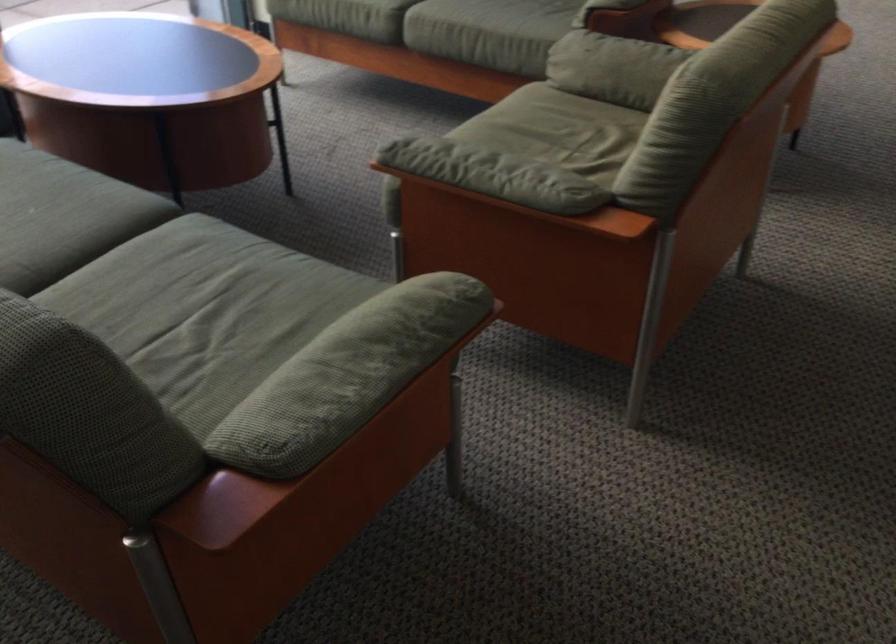
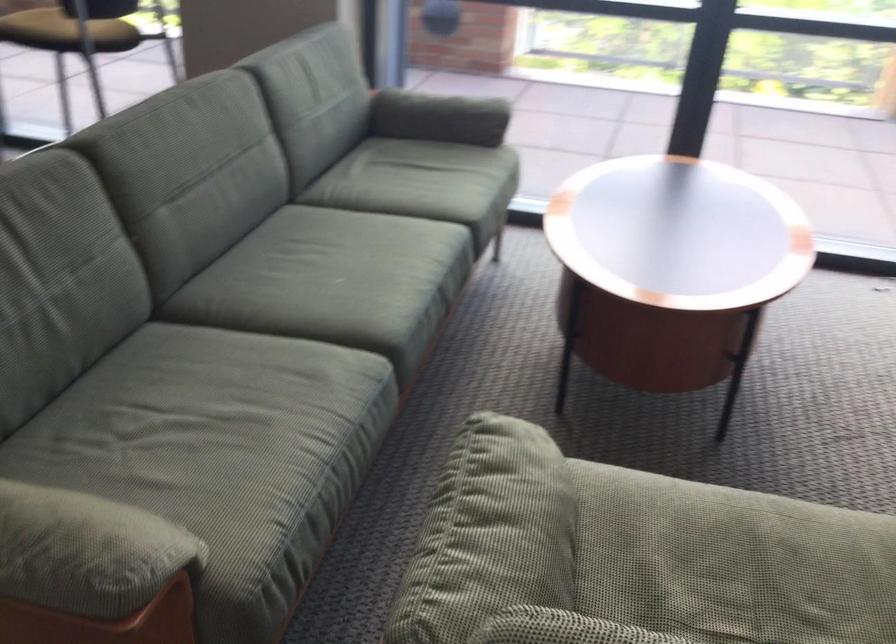
Find the pixel in the second image that matches pixel 524 152 in the first image.

(702, 582)